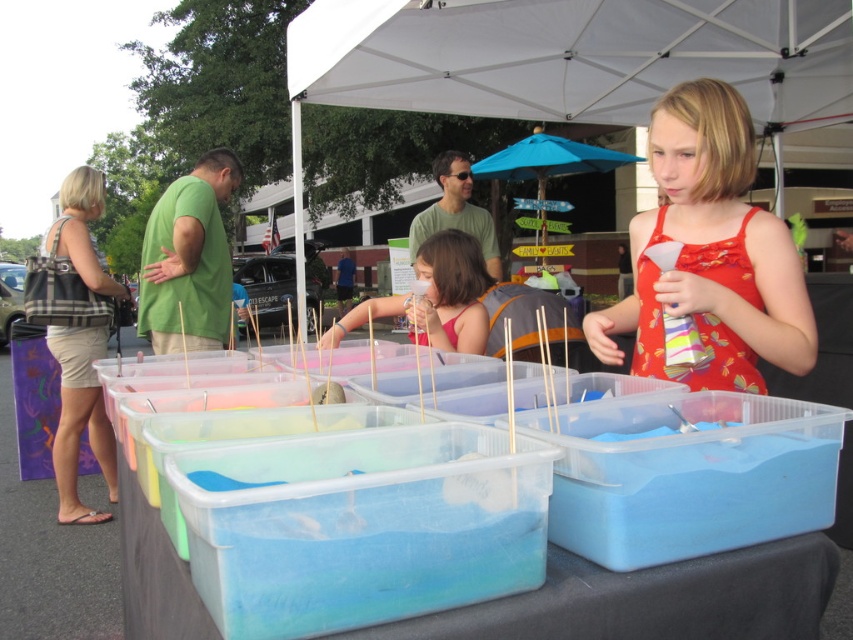
This screenshot has height=640, width=853. What do you see at coordinates (80, 419) in the screenshot?
I see `beige cotton shorts at left` at bounding box center [80, 419].

The width and height of the screenshot is (853, 640). Identify the location of beige cotton shorts at left. (80, 419).

Is point (73, 442) in front of point (529, 148)?

Yes, it is.

At what (x,y) coordinates should I click in order to perform the action: click on beige cotton shorts at left. Please return your answer as a coordinate pair (x, y). The image size is (853, 640). Looking at the image, I should click on (80, 419).

Is beige cotton shorts at left thinner than matte pink dress at center?

Incorrect, beige cotton shorts at left's width is not less than matte pink dress at center's.

Can you confirm if beige cotton shorts at left is shorter than matte pink dress at center?

In fact, beige cotton shorts at left may be taller than matte pink dress at center.

Find the location of `beige cotton shorts at left`. beige cotton shorts at left is located at coordinates (80, 419).

Which of these two, matte orange sundress at center or beige cotton shorts at left, stands taller?

Standing taller between the two is beige cotton shorts at left.

Is matte orange sundress at center taller than beige cotton shorts at left?

Incorrect, matte orange sundress at center's height is not larger of beige cotton shorts at left's.

Who is more forward, (714, 109) or (73, 176)?

Point (714, 109)

This screenshot has height=640, width=853. What are the coordinates of `matte orange sundress at center` in the screenshot? It's located at (711, 253).